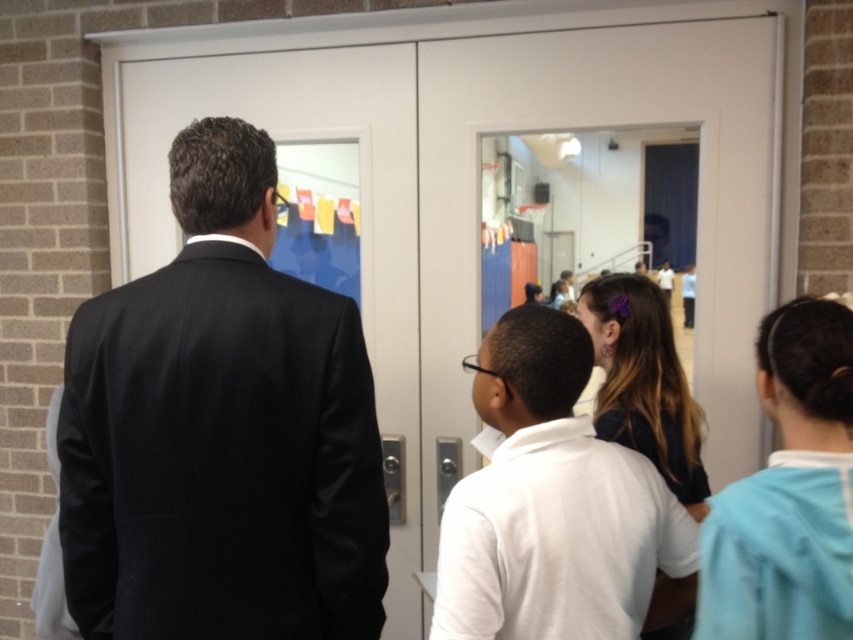
You are a photographer trying to capture a clear shot of the white matte shirt at center and the dark brown hair at center. Which one of these two objects should you focus on to ensure it appears more prominent in the photo?

The white matte shirt at center is larger in size than the dark brown hair at center, so focusing on the white matte shirt at center will make it appear more prominent in the photo.

You are a student trying to locate your teacher in the hallway. You see the white matte shirt at center and the dark brown hair at center. Which one is located lower in the scene?

The white matte shirt at center is positioned under dark brown hair at center, so the white matte shirt at center is lower in the scene.